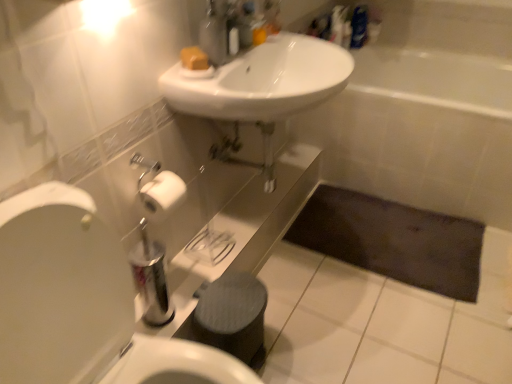
Question: Would you say matte plastic soap dispenser at upper center is part of white glossy toilet at left's contents?

Choices:
 (A) no
 (B) yes

Answer: (A)

Question: From the image's perspective, is white glossy toilet at left on top of matte plastic soap dispenser at upper center?

Choices:
 (A) no
 (B) yes

Answer: (A)

Question: Does white glossy toilet at left lie behind matte plastic soap dispenser at upper center?

Choices:
 (A) no
 (B) yes

Answer: (A)

Question: Is white glossy toilet at left shorter than matte plastic soap dispenser at upper center?

Choices:
 (A) no
 (B) yes

Answer: (A)

Question: Can you confirm if white glossy toilet at left is positioned to the right of matte plastic soap dispenser at upper center?

Choices:
 (A) no
 (B) yes

Answer: (A)

Question: In terms of height, does yellow matte soap at upper center look taller or shorter compared to white glossy toilet at left?

Choices:
 (A) tall
 (B) short

Answer: (B)

Question: Looking at the image, does yellow matte soap at upper center seem bigger or smaller compared to white glossy toilet at left?

Choices:
 (A) small
 (B) big

Answer: (A)

Question: Considering the positions of yellow matte soap at upper center and white glossy toilet at left in the image, is yellow matte soap at upper center wider or thinner than white glossy toilet at left?

Choices:
 (A) thin
 (B) wide

Answer: (A)

Question: From a real-world perspective, relative to white glossy toilet at left, is yellow matte soap at upper center vertically above or below?

Choices:
 (A) below
 (B) above

Answer: (B)

Question: Is white ceramic bathtub at center to the left or to the right of white glossy toilet at left in the image?

Choices:
 (A) right
 (B) left

Answer: (A)

Question: In terms of width, does white ceramic bathtub at center look wider or thinner when compared to white glossy toilet at left?

Choices:
 (A) wide
 (B) thin

Answer: (A)

Question: Is point (430, 99) positioned closer to the camera than point (110, 281)?

Choices:
 (A) farther
 (B) closer

Answer: (A)

Question: In the image, is white ceramic bathtub at center positioned in front of or behind white glossy toilet at left?

Choices:
 (A) behind
 (B) front

Answer: (A)

Question: From a real-world perspective, is white ceramic bathtub at center physically located above or below yellow matte soap at upper center?

Choices:
 (A) above
 (B) below

Answer: (B)

Question: In terms of height, does white ceramic bathtub at center look taller or shorter compared to yellow matte soap at upper center?

Choices:
 (A) short
 (B) tall

Answer: (B)